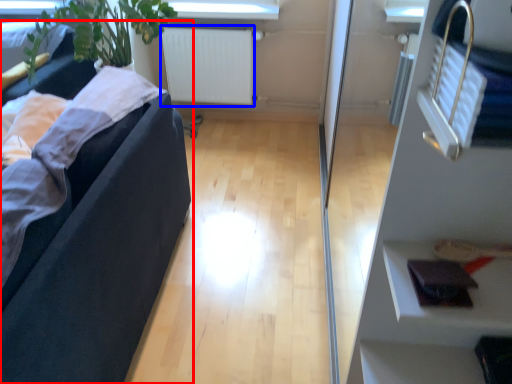
Question: Among these objects, which one is nearest to the camera, studio couch (highlighted by a red box) or radiator (highlighted by a blue box)?

Choices:
 (A) studio couch
 (B) radiator

Answer: (A)